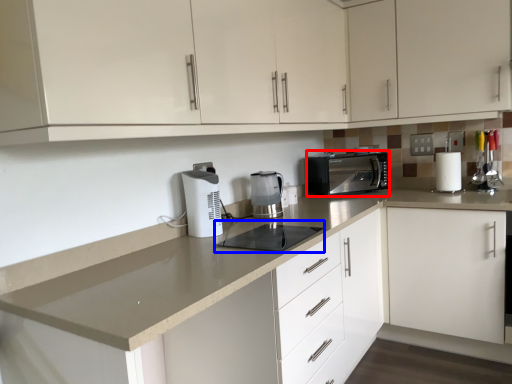
Question: Which object is closer to the camera taking this photo, kitchen appliance (highlighted by a red box) or appliance (highlighted by a blue box)?

Choices:
 (A) kitchen appliance
 (B) appliance

Answer: (B)